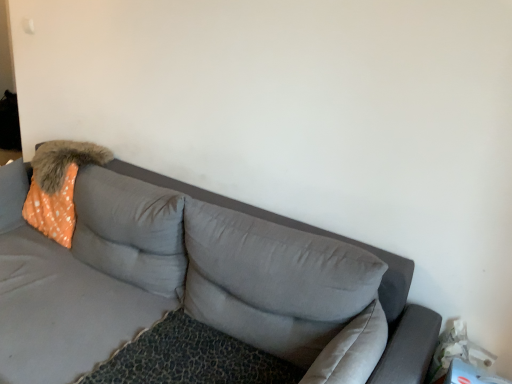
Question: Does orange dotted fabric at left have a greater width compared to orange dotted fabric pillow at upper left, which is counted as the second pillow, starting from the right?

Choices:
 (A) yes
 (B) no

Answer: (B)

Question: From a real-world perspective, is orange dotted fabric at left on top of orange dotted fabric pillow at upper left, which is counted as the second pillow, starting from the right?

Choices:
 (A) yes
 (B) no

Answer: (B)

Question: Is orange dotted fabric at left positioned beyond the bounds of orange dotted fabric pillow at upper left, arranged as the first pillow when viewed from the left?

Choices:
 (A) no
 (B) yes

Answer: (B)

Question: Is orange dotted fabric at left placed right next to orange dotted fabric pillow at upper left, arranged as the first pillow when viewed from the left?

Choices:
 (A) yes
 (B) no

Answer: (B)

Question: Is orange dotted fabric at left bigger than orange dotted fabric pillow at upper left, which is counted as the second pillow, starting from the right?

Choices:
 (A) yes
 (B) no

Answer: (A)

Question: Would you say orange dotted fabric pillow at upper left, arranged as the first pillow when viewed from the left, is inside or outside gray fabric couch at center?

Choices:
 (A) inside
 (B) outside

Answer: (A)

Question: From the image's perspective, is orange dotted fabric pillow at upper left, arranged as the first pillow when viewed from the left, positioned above or below gray fabric couch at center?

Choices:
 (A) below
 (B) above

Answer: (B)

Question: Relative to gray fabric couch at center, is orange dotted fabric pillow at upper left, which is counted as the second pillow, starting from the right, in front or behind?

Choices:
 (A) front
 (B) behind

Answer: (B)

Question: Considering the relative positions of orange dotted fabric pillow at upper left, arranged as the first pillow when viewed from the left, and gray fabric couch at center in the image provided, is orange dotted fabric pillow at upper left, arranged as the first pillow when viewed from the left, to the left or to the right of gray fabric couch at center?

Choices:
 (A) left
 (B) right

Answer: (B)

Question: From a real-world perspective, is gray fabric pillow at center, which is counted as the 2th pillow, starting from the left, positioned above or below gray fabric couch at center?

Choices:
 (A) above
 (B) below

Answer: (A)

Question: Looking at their shapes, would you say gray fabric pillow at center, which is counted as the 2th pillow, starting from the left, is wider or thinner than gray fabric couch at center?

Choices:
 (A) thin
 (B) wide

Answer: (A)

Question: From the image's perspective, is gray fabric pillow at center, which is counted as the first pillow, starting from the right, located above or below gray fabric couch at center?

Choices:
 (A) below
 (B) above

Answer: (B)

Question: Is gray fabric pillow at center, which is counted as the first pillow, starting from the right, inside or outside of gray fabric couch at center?

Choices:
 (A) outside
 (B) inside

Answer: (B)

Question: Does point (60, 205) appear closer or farther from the camera than point (115, 182)?

Choices:
 (A) closer
 (B) farther

Answer: (B)

Question: Is orange dotted fabric at left spatially inside gray fabric couch at center, or outside of it?

Choices:
 (A) inside
 (B) outside

Answer: (A)